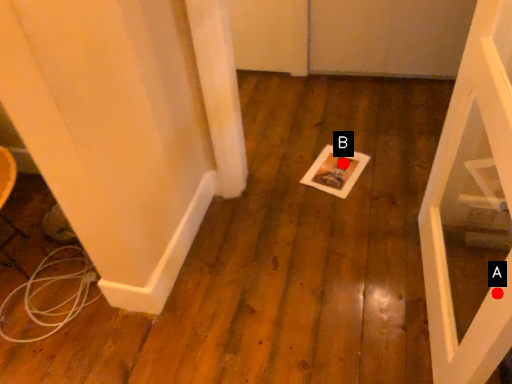
Question: Two points are circled on the image, labeled by A and B beside each circle. Which point appears farthest from the camera in this image?

Choices:
 (A) A is further
 (B) B is further

Answer: (B)